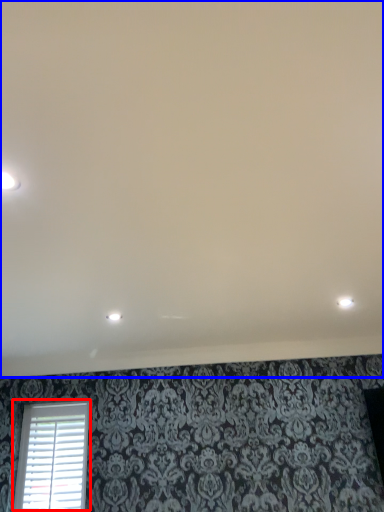
Question: Which object is further to the camera taking this photo, window (highlighted by a red box) or backdrop (highlighted by a blue box)?

Choices:
 (A) window
 (B) backdrop

Answer: (A)